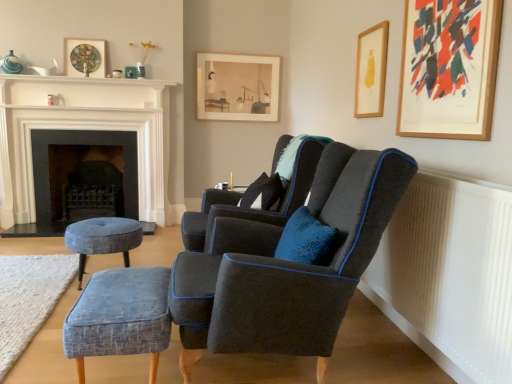
Locate an element on the screen. vacant space situated above matte paper picture frame at upper center, positioned as the 3th picture frame in right-to-left order (from a real-world perspective) is located at coordinates (238, 54).